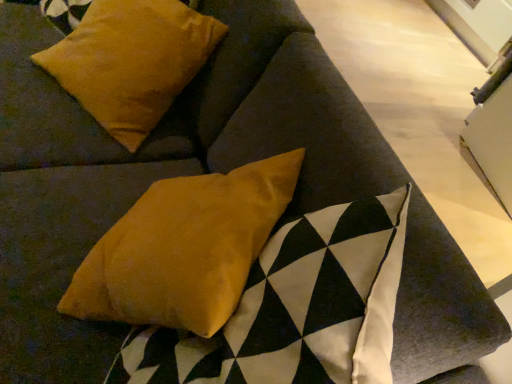
Where is `mustard velvet pillow at upper left`? The height and width of the screenshot is (384, 512). mustard velvet pillow at upper left is located at coordinates (131, 61).

The image size is (512, 384). Describe the element at coordinates (131, 61) in the screenshot. I see `mustard velvet pillow at upper left` at that location.

What is the approximate width of mustard velvet pillow at upper left?

mustard velvet pillow at upper left is 39.53 centimeters wide.

The image size is (512, 384). Identify the location of mustard velvet pillow at upper left. (131, 61).